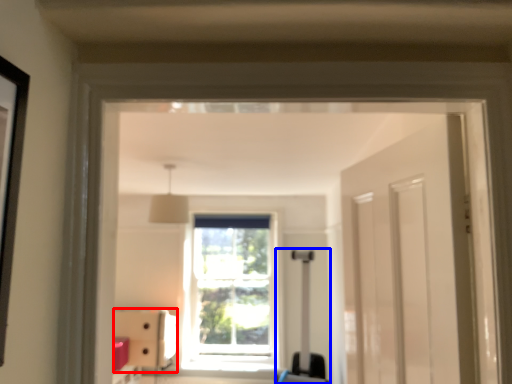
Question: Which object is closer to the camera taking this photo, furniture (highlighted by a red box) or luggage (highlighted by a blue box)?

Choices:
 (A) furniture
 (B) luggage

Answer: (B)